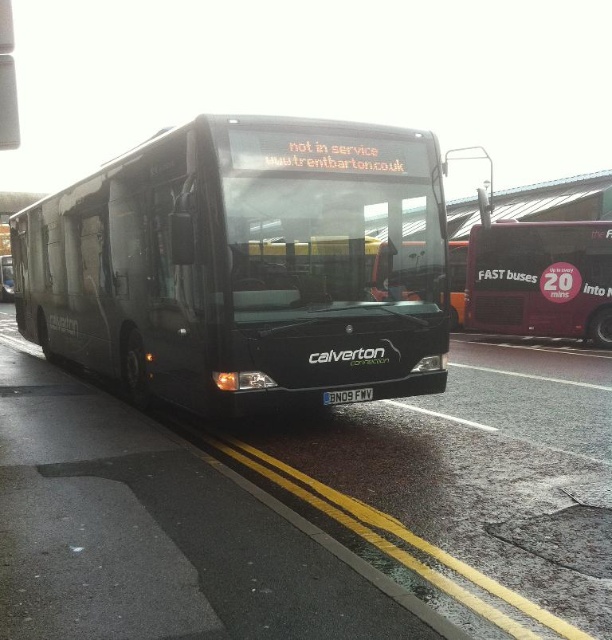
Between matte black bus at center and black plastic license plate at center, which one appears on the left side from the viewer's perspective?

matte black bus at center

Does point (392, 316) lie behind point (329, 394)?

Yes, point (392, 316) is farther from viewer.

Does point (231, 147) lie behind point (370, 392)?

No, (231, 147) is closer to viewer.

Find the location of a particular element. Image resolution: width=612 pixels, height=640 pixels. matte black bus at center is located at coordinates (245, 264).

Looking at this image, who is positioned more to the right, maroon metallic bus at right or black plastic license plate at center?

From the viewer's perspective, maroon metallic bus at right appears more on the right side.

Is point (480, 262) in front of point (334, 396)?

No, (480, 262) is behind (334, 396).

Image resolution: width=612 pixels, height=640 pixels. Identify the location of maroon metallic bus at right. pos(540,280).

Between matte black bus at center and maroon metallic bus at right, which one has more height?

Standing taller between the two is matte black bus at center.

Can you confirm if matte black bus at center is wider than maroon metallic bus at right?

Indeed, matte black bus at center has a greater width compared to maroon metallic bus at right.

Which is in front, point (119, 310) or point (482, 320)?

Point (119, 310)

Locate an element on the screen. Image resolution: width=612 pixels, height=640 pixels. matte black bus at center is located at coordinates tap(245, 264).